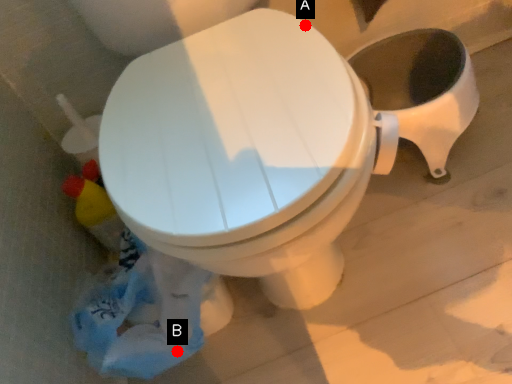
Question: Two points are circled on the image, labeled by A and B beside each circle. Among these points, which one is farthest from the camera?

Choices:
 (A) A is further
 (B) B is further

Answer: (B)